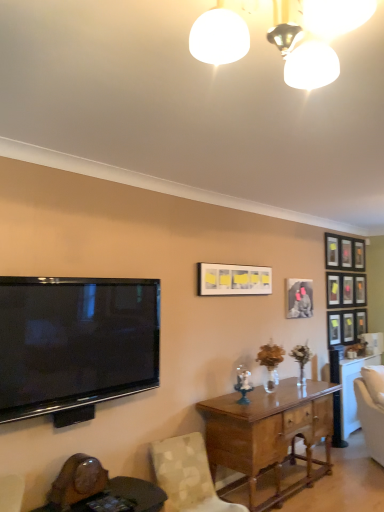
Find the location of a particular element. Image resolution: width=384 pixels, height=512 pixels. vacant space to the right of light brown wood desk at center is located at coordinates (342, 489).